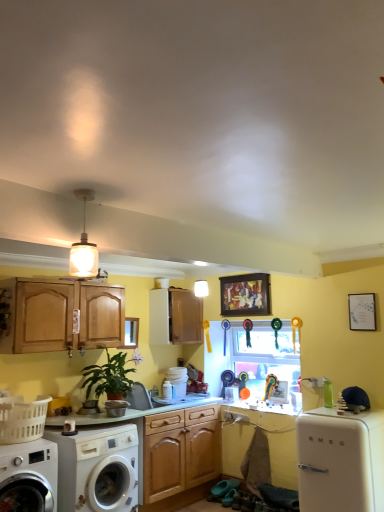
Find the location of `white glossy refrigerator at lower right`. white glossy refrigerator at lower right is located at coordinates (340, 460).

The width and height of the screenshot is (384, 512). Describe the element at coordinates (97, 469) in the screenshot. I see `white glossy washing machine at lower left, positioned as the 1th washing machine in right-to-left order` at that location.

Image resolution: width=384 pixels, height=512 pixels. What do you see at coordinates (138, 411) in the screenshot?
I see `green matte countertop at center` at bounding box center [138, 411].

I want to click on clear glass window screen at center, so pos(267,359).

At what (x,y) coordinates should I click in order to perform the action: click on white glossy washing machine at lower left, which is counted as the second washing machine, starting from the right. Please return your answer as a coordinate pair (x, y). This screenshot has width=384, height=512. Looking at the image, I should click on (29, 477).

Considering the sizes of objects clear glass window screen at center and white glass pendant light at upper center in the image provided, who is wider, clear glass window screen at center or white glass pendant light at upper center?

clear glass window screen at center is wider.

Can you confirm if clear glass window screen at center is positioned to the right of white glass pendant light at upper center?

Yes, clear glass window screen at center is to the right of white glass pendant light at upper center.

Is clear glass window screen at center not close to white glass pendant light at upper center?

Yes, clear glass window screen at center and white glass pendant light at upper center are located far from each other.

At what (x,y) coordinates should I click in order to perform the action: click on light fixture on the left of clear glass window screen at center. Please return your answer as a coordinate pair (x, y). The width and height of the screenshot is (384, 512). Looking at the image, I should click on (84, 246).

Could you tell me if wooden framed artwork at upper center is turned towards green matte plant at lower left?

No, wooden framed artwork at upper center is not aimed at green matte plant at lower left.

Would you say wooden framed artwork at upper center is inside or outside green matte plant at lower left?

wooden framed artwork at upper center lies outside green matte plant at lower left.

What's the angular difference between wooden framed artwork at upper center and green matte plant at lower left's facing directions?

There is a 89.1-degree angle between the facing directions of wooden framed artwork at upper center and green matte plant at lower left.

Who is taller, wooden framed artwork at upper center or green matte plant at lower left?

With more height is green matte plant at lower left.

In the image, is white glossy washing machine at lower left, positioned as the 2th washing machine in left-to-right order, on the left side or the right side of metallic silver washing machine at lower left?

In the image, white glossy washing machine at lower left, positioned as the 2th washing machine in left-to-right order, appears on the left side of metallic silver washing machine at lower left.

Could you tell me if white glossy washing machine at lower left, positioned as the 1th washing machine in right-to-left order, is turned towards metallic silver washing machine at lower left?

No, white glossy washing machine at lower left, positioned as the 1th washing machine in right-to-left order, is not facing towards metallic silver washing machine at lower left.

Would you say white glossy washing machine at lower left, positioned as the 2th washing machine in left-to-right order, is inside or outside metallic silver washing machine at lower left?

The correct answer is: outside.

Is the depth of white glossy washing machine at lower left, positioned as the 2th washing machine in left-to-right order, greater than that of green matte plant at lower left?

That is False.

Looking at this image, based on their positions, is white glossy washing machine at lower left, positioned as the 2th washing machine in left-to-right order, located to the left or right of green matte plant at lower left?

→ white glossy washing machine at lower left, positioned as the 2th washing machine in left-to-right order, is to the left of green matte plant at lower left.

From a real-world perspective, is white glossy washing machine at lower left, positioned as the 1th washing machine in right-to-left order, above or below green matte plant at lower left?

white glossy washing machine at lower left, positioned as the 1th washing machine in right-to-left order, is below green matte plant at lower left.

Does point (114, 507) lie behind point (93, 377)?

No, (114, 507) is closer to viewer.

Is white glossy washing machine at lower left, which is counted as the second washing machine, starting from the right, completely or partially inside wooden framed artwork at upper center?

No.

From a real-world perspective, is wooden framed artwork at upper center above or below white glossy washing machine at lower left, which is counted as the second washing machine, starting from the right?

From a real-world perspective, wooden framed artwork at upper center is physically above white glossy washing machine at lower left, which is counted as the second washing machine, starting from the right.

Considering the sizes of objects wooden framed artwork at upper center and white glossy washing machine at lower left, which is counted as the second washing machine, starting from the right, in the image provided, who is bigger, wooden framed artwork at upper center or white glossy washing machine at lower left, which is counted as the second washing machine, starting from the right,?

white glossy washing machine at lower left, which is counted as the second washing machine, starting from the right.

Would you say wooden framed artwork at upper center is to the left or to the right of white glossy washing machine at lower left, the 1th washing machine when ordered from left to right, in the picture?

wooden framed artwork at upper center is positioned on white glossy washing machine at lower left, the 1th washing machine when ordered from left to right,'s right side.

Would you say matte wood cabinet at center is a long distance from wooden framed artwork at upper center?

They are positioned close to each other.

Can we say matte wood cabinet at center lies outside wooden framed artwork at upper center?

Yes.

Is matte wood cabinet at center oriented towards wooden framed artwork at upper center?

Yes, matte wood cabinet at center is facing wooden framed artwork at upper center.

Considering the sizes of matte wood cabinet at center and wooden framed artwork at upper center in the image, is matte wood cabinet at center wider or thinner than wooden framed artwork at upper center?

In the image, matte wood cabinet at center appears to be wider than wooden framed artwork at upper center.

Is white plastic laundry basket at lower left aimed at white glass pendant light at upper center?

No, white plastic laundry basket at lower left is not turned towards white glass pendant light at upper center.

From the image's perspective, is white plastic laundry basket at lower left above or below white glass pendant light at upper center?

white plastic laundry basket at lower left is situated lower than white glass pendant light at upper center in the image.

The image size is (384, 512). I want to click on light fixture that appears above the clear glass window screen at center (from a real-world perspective), so click(84, 246).

The width and height of the screenshot is (384, 512). I want to click on houseplant below the wooden framed artwork at upper center (from a real-world perspective), so click(108, 378).

Based on the photo, based on their spatial positions, is white plastic laundry basket at lower left or white glossy refrigerator at lower right further from white glossy washing machine at lower left, positioned as the 1th washing machine in right-to-left order?

white glossy refrigerator at lower right.

Consider the image. Considering their positions, is white glossy washing machine at lower left, which is counted as the second washing machine, starting from the right, positioned closer to matte wood cabinet at center than white glossy washing machine at lower left, positioned as the 2th washing machine in left-to-right order?

white glossy washing machine at lower left, positioned as the 2th washing machine in left-to-right order.

From the image, which object appears to be nearer to white plastic laundry basket at lower left, white glossy washing machine at lower left, positioned as the 1th washing machine in right-to-left order, or green matte plant at lower left?

Based on the image, white glossy washing machine at lower left, positioned as the 1th washing machine in right-to-left order, appears to be nearer to white plastic laundry basket at lower left.

In the scene shown: Looking at the image, which one is located closer to green matte countertop at center, clear glass window screen at center or matte wood cabinet at center?

clear glass window screen at center is positioned closer to the anchor green matte countertop at center.

Estimate the real-world distances between objects in this image. Which object is closer to green matte countertop at center, white glossy washing machine at lower left, positioned as the 1th washing machine in right-to-left order, or green matte plant at lower left?

white glossy washing machine at lower left, positioned as the 1th washing machine in right-to-left order, is closer to green matte countertop at center.

When comparing their distances from clear glass window screen at center, does white glossy washing machine at lower left, positioned as the 1th washing machine in right-to-left order, or white glossy refrigerator at lower right seem further?

The object further to clear glass window screen at center is white glossy washing machine at lower left, positioned as the 1th washing machine in right-to-left order.

When comparing their distances from white glossy washing machine at lower left, the 1th washing machine when ordered from left to right, does white glass pendant light at upper center or clear glass window screen at center seem closer?

Among the two, white glass pendant light at upper center is located nearer to white glossy washing machine at lower left, the 1th washing machine when ordered from left to right.

Considering their positions, is white glossy washing machine at lower left, which is counted as the second washing machine, starting from the right, positioned closer to white plastic laundry basket at lower left than matte wood cabinet at center?

Based on the image, white glossy washing machine at lower left, which is counted as the second washing machine, starting from the right, appears to be nearer to white plastic laundry basket at lower left.

Find the location of `countertop situated between white glossy washing machine at lower left, positioned as the 2th washing machine in left-to-right order, and white glossy refrigerator at lower right from left to right`. countertop situated between white glossy washing machine at lower left, positioned as the 2th washing machine in left-to-right order, and white glossy refrigerator at lower right from left to right is located at coordinates (138, 411).

Identify the location of countertop situated between white plastic laundry basket at lower left and clear glass window screen at center from left to right. (138, 411).

Where is `countertop between white glass pendant light at upper center and matte wood cabinet at center in the front-back direction`? countertop between white glass pendant light at upper center and matte wood cabinet at center in the front-back direction is located at coordinates (138, 411).

Identify the location of houseplant positioned between white glass pendant light at upper center and wooden framed artwork at upper center from near to far. (108, 378).